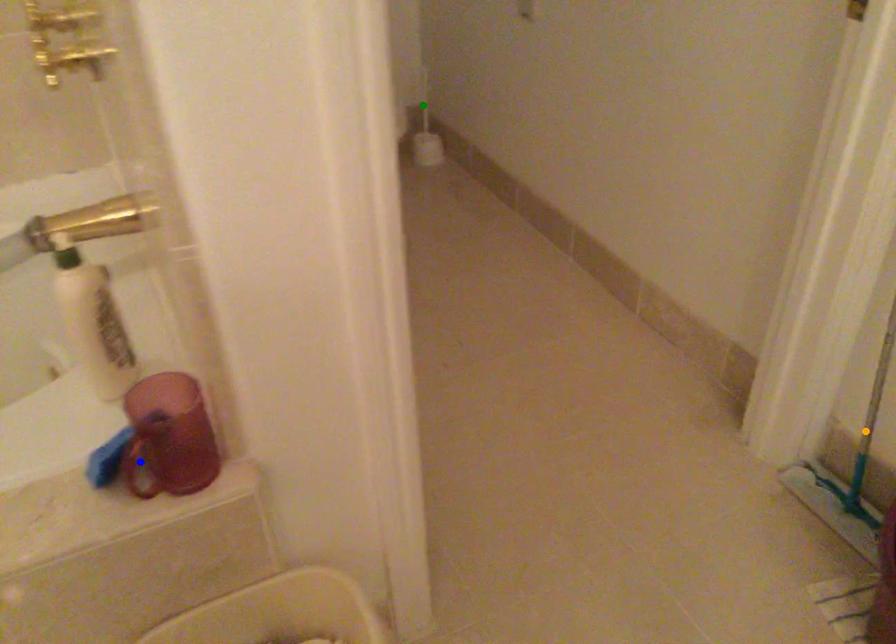
Order these from nearest to farthest:
green point, blue point, orange point

blue point → orange point → green point